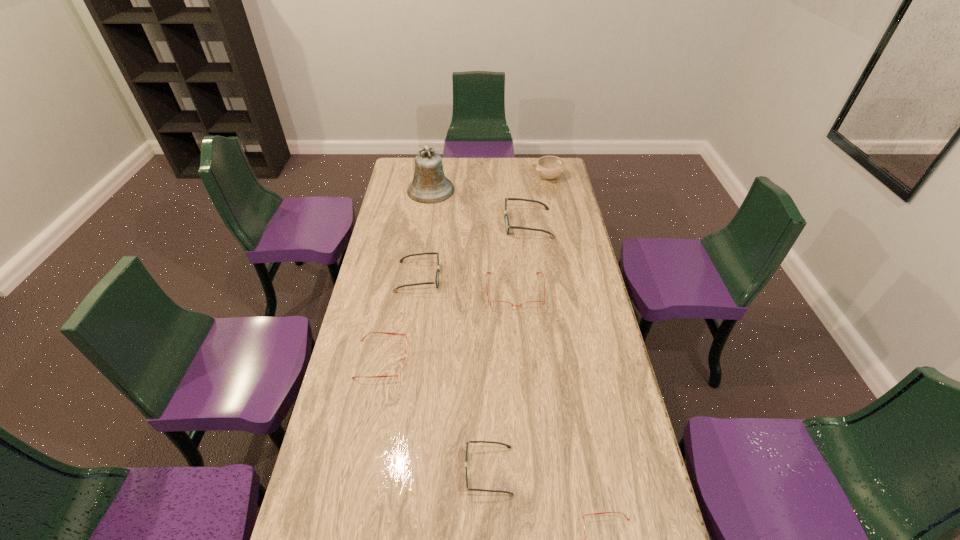
You are a GUI agent. You are given a task and a screenshot of the screen. Output one action in this format:
    pyautogui.click(x=<x>, y=<y>)
    Task: Click on the free space between the farthest pink spectacles and the second smallest gray spectacles
    The height and width of the screenshot is (540, 960).
    Given the screenshot: What is the action you would take?
    pyautogui.click(x=467, y=285)

Find the location of a particular element. The height and width of the screenshot is (540, 960). free space that is in between the biggest gray spectacles and the tallest object is located at coordinates coord(479,207).

Identify the location of free space between the nearest gray spectacles and the leftmost gray spectacles. click(x=453, y=374).

Identify which object is located as the sixth nearest to the beige bowl. Please provide its 2D coordinates. Your answer should be formatted as a tuple, i.e. [(x, y)], where the tuple contains the x and y coordinates of a point satisfying the conditions above.

[(467, 443)]

Choose which object is the sixth nearest neighbor to the biggest pink spectacles. Please provide its 2D coordinates. Your answer should be formatted as a tuple, i.e. [(x, y)], where the tuple contains the x and y coordinates of a point satisfying the conditions above.

[(550, 167)]

At what (x,y) coordinates should I click in order to perform the action: click on the fourth closest spectacles to the second pink spectacles from right to left. Please return your answer as a coordinate pair (x, y). The width and height of the screenshot is (960, 540). Looking at the image, I should click on (467, 443).

Identify which spectacles is the second nearest to the tallest object. Please provide its 2D coordinates. Your answer should be formatted as a tuple, i.e. [(x, y)], where the tuple contains the x and y coordinates of a point satisfying the conditions above.

[(436, 281)]

Find the location of `gray spectacles that is the third nearest to the third nearest object`. gray spectacles that is the third nearest to the third nearest object is located at coordinates (507, 225).

Choose which gray spectacles is the second nearest neighbor to the beige bowl. Please provide its 2D coordinates. Your answer should be formatted as a tuple, i.e. [(x, y)], where the tuple contains the x and y coordinates of a point satisfying the conditions above.

[(436, 281)]

Where is `pink spectacles that is the second closest one to the tallest object`? This screenshot has height=540, width=960. pink spectacles that is the second closest one to the tallest object is located at coordinates (402, 367).